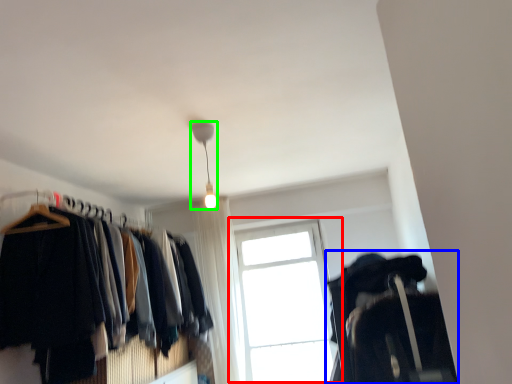
Question: Estimate the real-world distances between objects in this image. Which object is closer to window (highlighted by a red box), closet (highlighted by a blue box) or lamp (highlighted by a green box)?

Choices:
 (A) closet
 (B) lamp

Answer: (A)